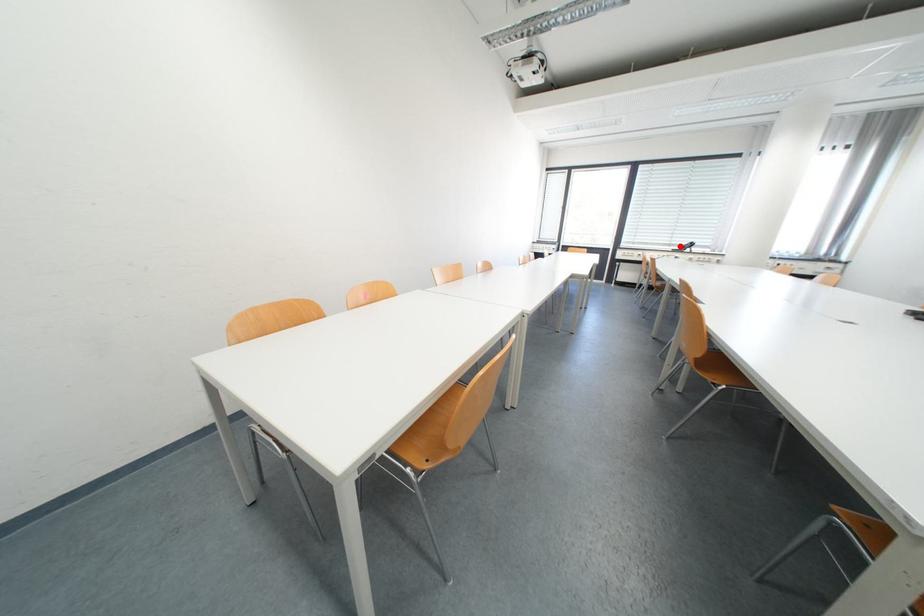
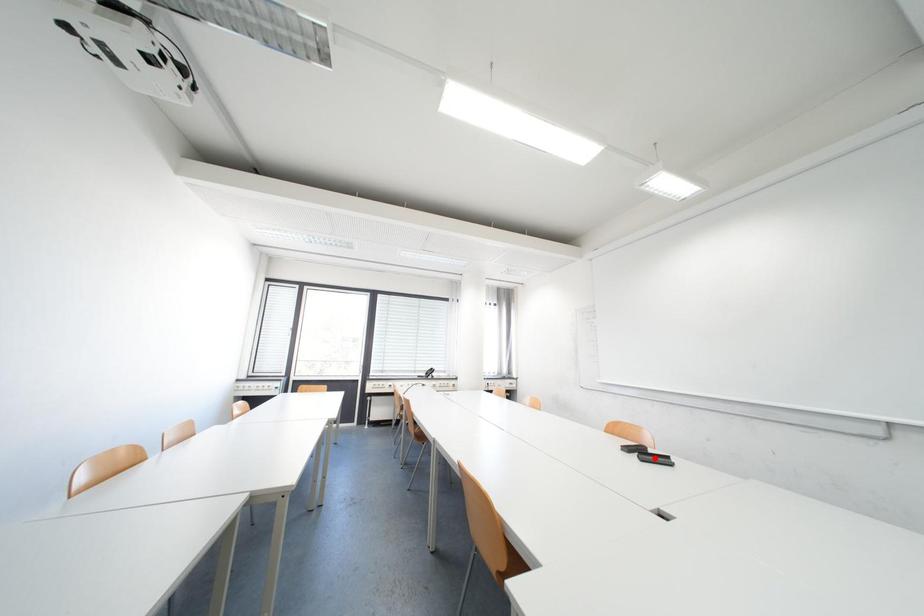
I am providing you with two images of the same scene from different viewpoints. A red point is marked on the first image and another point is marked on the second image. Is the red point in image1 aligned with the point shown in image2?

No